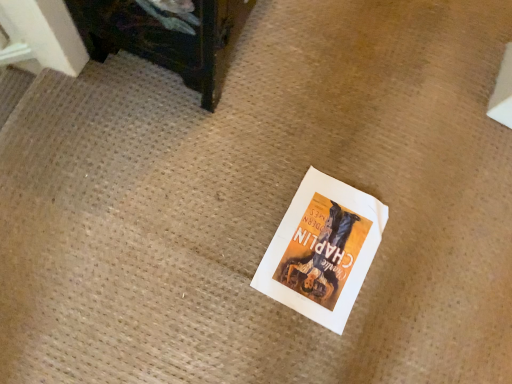
Image resolution: width=512 pixels, height=384 pixels. In order to click on white paper at center in this screenshot , I will do `click(322, 250)`.

Measure the distance between point (317, 241) and camera.

35.87 inches.

Describe the element at coordinates (322, 250) in the screenshot. I see `white paper at center` at that location.

Find the location of `white paper at center`. white paper at center is located at coordinates point(322,250).